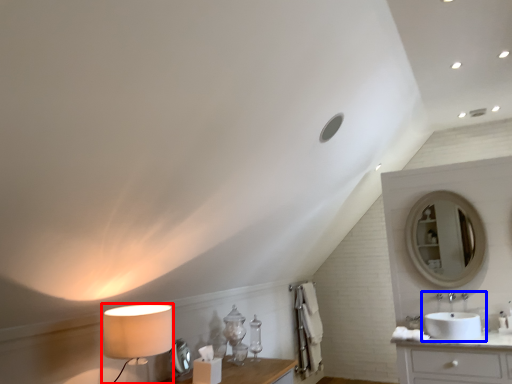
Question: Among these objects, which one is farthest to the camera, table lamp (highlighted by a red box) or sink (highlighted by a blue box)?

Choices:
 (A) table lamp
 (B) sink

Answer: (B)